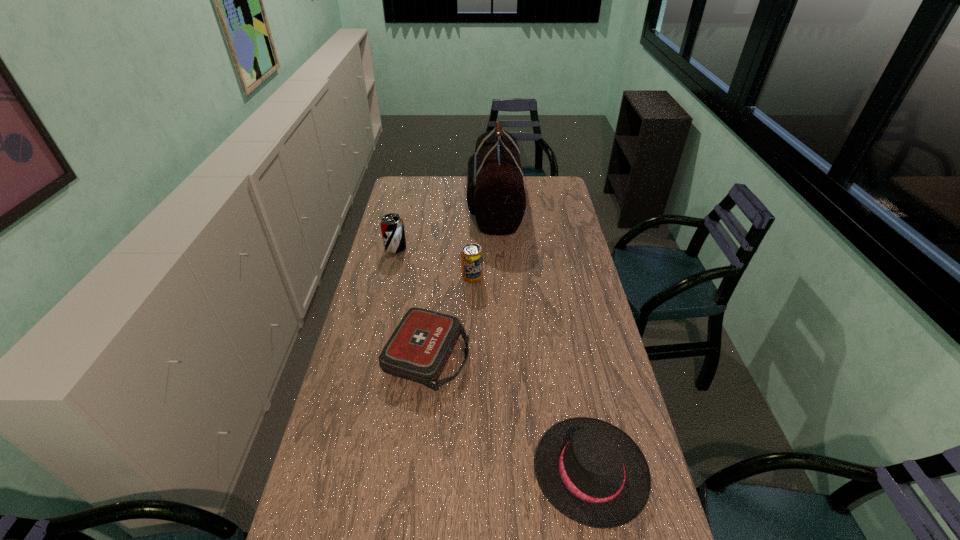
This screenshot has width=960, height=540. I want to click on vacant position located on the front pocket of the tallest object, so coord(435,205).

Where is `vacant space positioned on the front pocket of the tallest object`? The image size is (960, 540). vacant space positioned on the front pocket of the tallest object is located at coordinates (398, 205).

Locate an element on the screen. The image size is (960, 540). free space located 0.380m on the right of the left soda can is located at coordinates (493, 248).

Locate an element on the screen. The width and height of the screenshot is (960, 540). vacant region located 0.320m on the back of the third nearest object is located at coordinates (473, 226).

Where is `free space located 0.100m on the left of the nearest object`? Image resolution: width=960 pixels, height=540 pixels. free space located 0.100m on the left of the nearest object is located at coordinates (497, 471).

This screenshot has width=960, height=540. Identify the location of free location located on the left of the second nearest object. (346, 356).

Locate an element on the screen. This screenshot has height=540, width=960. object that is positioned at the far edge is located at coordinates (495, 193).

Locate an element on the screen. This screenshot has width=960, height=540. soda can that is positioned at the left edge is located at coordinates (392, 227).

Where is `the first-aid kit that is at the left edge`? The width and height of the screenshot is (960, 540). the first-aid kit that is at the left edge is located at coordinates (418, 350).

Locate an element on the screen. object located at the right edge is located at coordinates (591, 471).